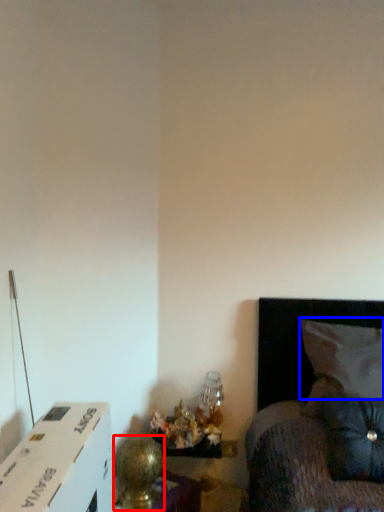
Question: Among these objects, which one is nearest to the camera, table lamp (highlighted by a red box) or pillow (highlighted by a blue box)?

Choices:
 (A) table lamp
 (B) pillow

Answer: (A)